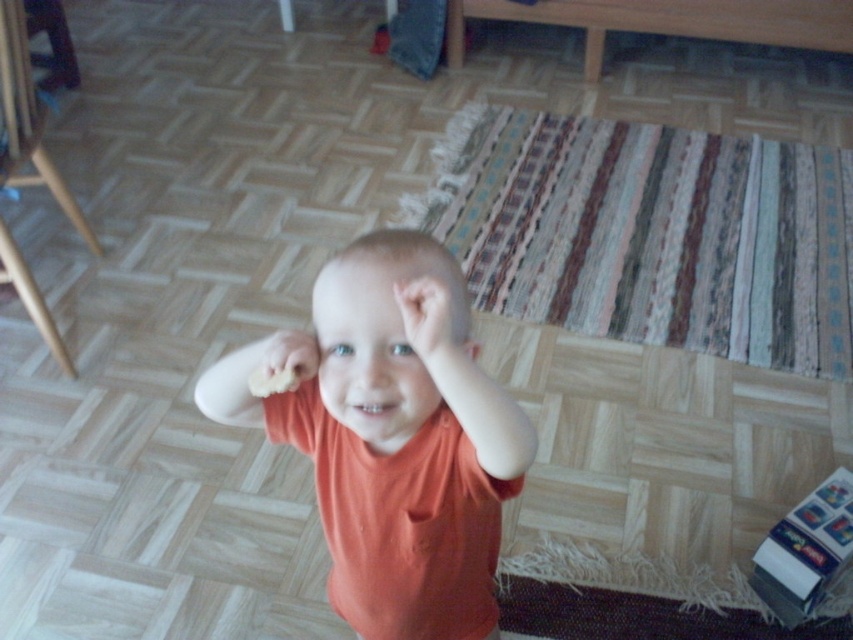
Which is behind, point (438, 307) or point (479, 349)?

The point (479, 349) is behind.

Does matte orange hand at center appear on the left side of matte orange ear at center?

Yes, matte orange hand at center is to the left of matte orange ear at center.

Where is `matte orange hand at center`? This screenshot has width=853, height=640. matte orange hand at center is located at coordinates (431, 317).

Based on the photo, is orange matte head at center above matte orange ear at center?

No.

Does point (433, 241) lie in front of point (473, 346)?

Yes, it is in front of point (473, 346).

Locate an element on the screen. orange matte head at center is located at coordinates (386, 332).

Who is more forward, (297, 353) or (473, 355)?

Point (297, 353) is in front.

From the picture: Does smooth beige hand at center come behind matte orange ear at center?

No, it is in front of matte orange ear at center.

You are a GUI agent. You are given a task and a screenshot of the screen. Output one action in this format:
    pyautogui.click(x=<x>, y=<y>)
    Task: Click on the smooth beige hand at center
    Image resolution: width=853 pixels, height=640 pixels.
    Given the screenshot: What is the action you would take?
    pyautogui.click(x=283, y=362)

Locate an element on the screen. smooth beige hand at center is located at coordinates (283, 362).